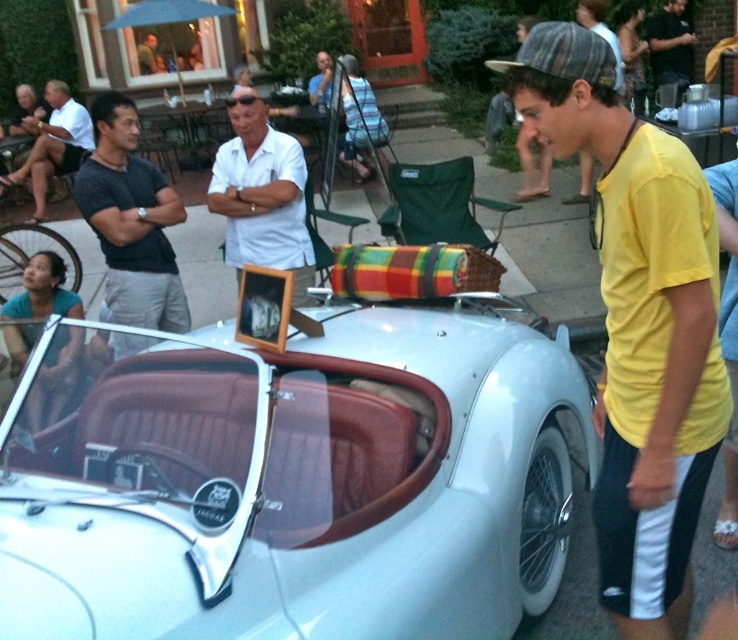
You are a photographer at the car show and want to capture both the yellow cotton shirt at center and the dark gray fabric shirt at left in the same frame. Which shirt should you focus on to ensure both are in the shot?

You should focus on the yellow cotton shirt at center because it is taller than the dark gray fabric shirt at left, so keeping it centered will include both shirts in the frame.

You are a photographer at the car show and want to capture both the yellow cotton shirt at center and the white cotton shirt at upper left in a single shot. Which shirt should you focus on first to ensure both are in frame?

The yellow cotton shirt at center has a lesser height compared to the white cotton shirt at upper left. To capture both in a single shot, focus on the taller white cotton shirt at upper left first, then adjust the frame to include the shorter yellow cotton shirt at center.

You are a photographer standing at the center of the scene. You want to take a photo of both the white cotton shirt at upper left and the dark blue jeans at upper right in the same frame. Given that your camera has a maximum zoom range of 10 feet, can you capture both subjects without moving closer?

The white cotton shirt at upper left and dark blue jeans at upper right are 26.40 feet apart. Since the camera can only zoom up to 10 feet, the distance between them exceeds the maximum zoom range. Therefore, you cannot capture both in the same frame without moving closer.